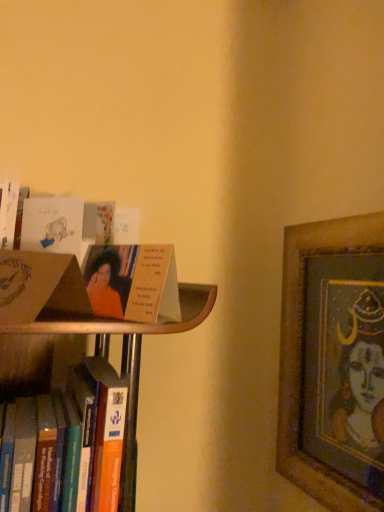
Question: From the image's perspective, is matte cardboard book at upper left above or below matte cardboard book at left, which is the 1th paperback book in front-to-back order?

Choices:
 (A) below
 (B) above

Answer: (A)

Question: Looking at their shapes, would you say matte cardboard book at upper left is wider or thinner than matte cardboard book at left, which is the second paperback book from back to front?

Choices:
 (A) thin
 (B) wide

Answer: (A)

Question: Considering the real-world distances, which object is farthest from the matte white card at upper left, the second paperback book in the front-to-back sequence?

Choices:
 (A) wooden framed artwork at right
 (B) matte cardboard book at upper left
 (C) matte cardboard book at left, which is the first paperback book from bottom to top

Answer: (A)

Question: Based on their relative distances, which object is farther from the wooden framed artwork at right?

Choices:
 (A) matte white card at upper left, the first paperback book in the top-to-bottom sequence
 (B) matte cardboard book at left, which is the 1th paperback book in front-to-back order
 (C) matte cardboard book at upper left

Answer: (A)